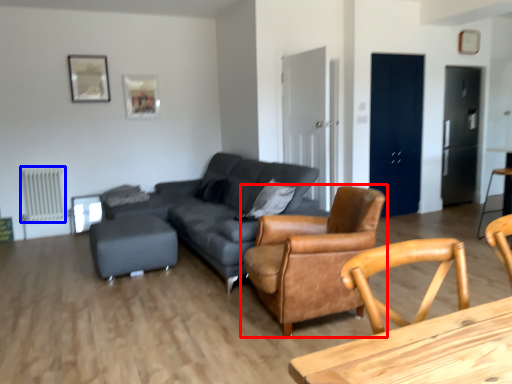
Question: Which object is further to the camera taking this photo, chair (highlighted by a red box) or radiator (highlighted by a blue box)?

Choices:
 (A) chair
 (B) radiator

Answer: (B)